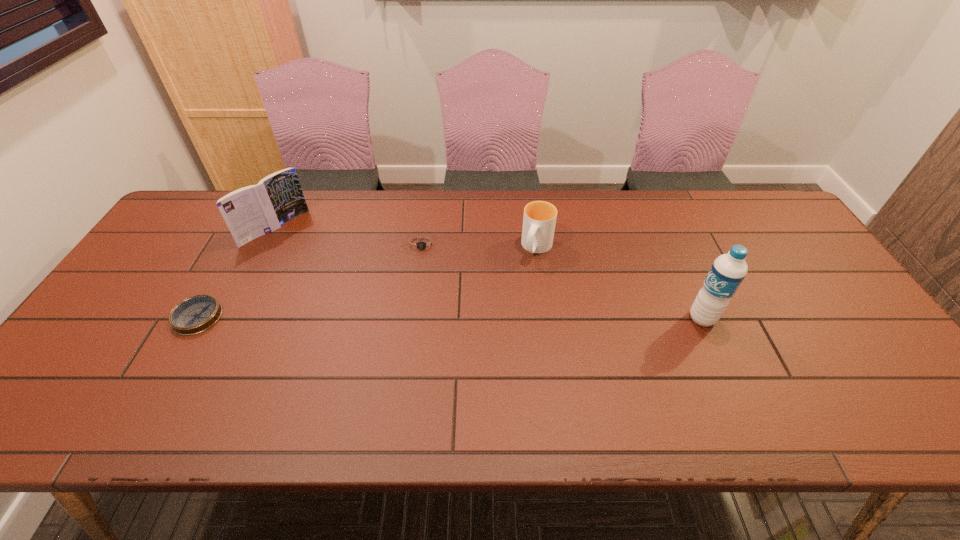
This screenshot has width=960, height=540. I want to click on free space between the water bottle and the book, so click(489, 274).

Where is `vacant point located between the rightmost object and the compass`? vacant point located between the rightmost object and the compass is located at coordinates (450, 318).

What are the coordinates of `vacant space in between the shortest object and the tallest object` in the screenshot? It's located at (450, 318).

Where is `vacant space that's between the rightmost object and the third object from right to left`? This screenshot has width=960, height=540. vacant space that's between the rightmost object and the third object from right to left is located at coordinates (563, 281).

Where is `vacant area between the watch and the shortest object`? The height and width of the screenshot is (540, 960). vacant area between the watch and the shortest object is located at coordinates (310, 281).

I want to click on free point between the fourth shortest object and the shortest object, so click(x=236, y=273).

Where is `object that can be found as the fourth closest to the shortest object`? The image size is (960, 540). object that can be found as the fourth closest to the shortest object is located at coordinates (727, 272).

Identify which object is located as the third nearest to the compass. Please provide its 2D coordinates. Your answer should be formatted as a tuple, i.e. [(x, y)], where the tuple contains the x and y coordinates of a point satisfying the conditions above.

[(539, 220)]

Locate an element on the screen. The height and width of the screenshot is (540, 960). vacant region that satisfies the following two spatial constraints: 1. on the front side of the third shortest object; 2. on the label of the tallest object is located at coordinates (547, 319).